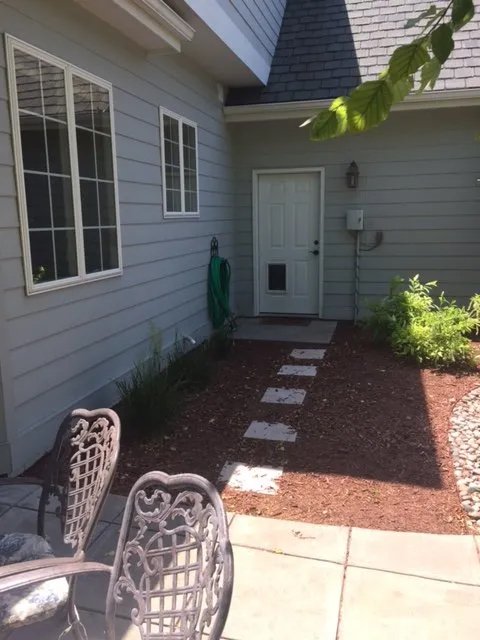
This screenshot has height=640, width=480. I want to click on door handle, so point(314,253).